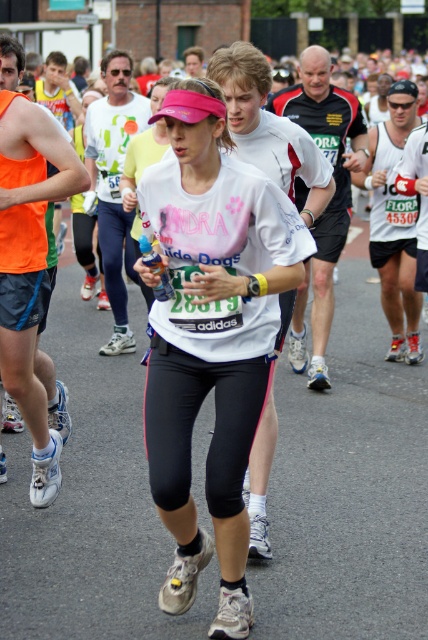
Question: Observing the image, what is the correct spatial positioning of white matte running shirt at center in reference to orange fabric tank top at left?

Choices:
 (A) above
 (B) below

Answer: (B)

Question: In this image, where is white matte running shirt at center located relative to white matte tank top at center?

Choices:
 (A) above
 (B) below

Answer: (B)

Question: Which of these objects is positioned closest to the matte white t-shirt at center?

Choices:
 (A) white matte running shirt at center
 (B) orange fabric tank top at left

Answer: (B)

Question: Which point is farther to the camera?

Choices:
 (A) (409, 118)
 (B) (100, 102)
 (C) (216, 161)

Answer: (B)

Question: Is orange fabric tank top at left closer to camera compared to matte white t-shirt at center?

Choices:
 (A) yes
 (B) no

Answer: (A)

Question: Which point is closer to the camera?

Choices:
 (A) (9, 134)
 (B) (109, 211)
 (C) (321, 244)
 (D) (377, 250)

Answer: (A)